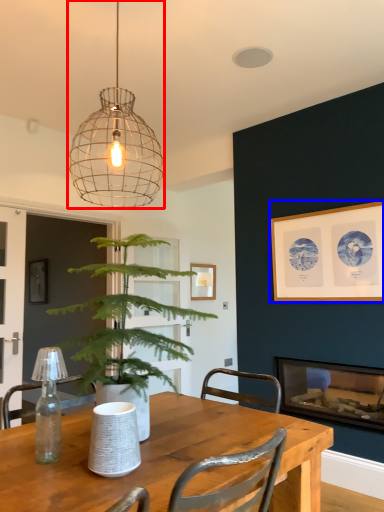
Question: Which point is further to the camera, lamp (highlighted by a red box) or picture frame (highlighted by a blue box)?

Choices:
 (A) lamp
 (B) picture frame

Answer: (B)